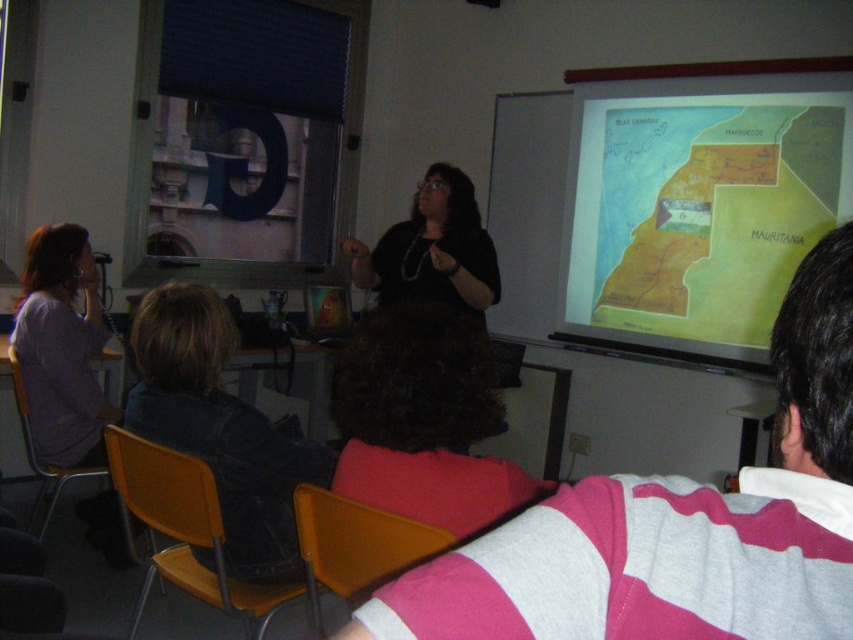
Question: Estimate the real-world distances between objects in this image. Which object is closer to the striped cotton shirt at center?

Choices:
 (A) dark blue jacket at lower left
 (B) yellow paper map at upper right

Answer: (A)

Question: Is striped cotton shirt at center below yellow paper map at upper right?

Choices:
 (A) yes
 (B) no

Answer: (A)

Question: Which of these objects is positioned farthest from the dark blue jacket at lower left?

Choices:
 (A) striped cotton shirt at center
 (B) yellow paper map at upper right

Answer: (B)

Question: Which of the following is the farthest from the observer?

Choices:
 (A) (717, 285)
 (B) (590, 532)

Answer: (A)

Question: From the image, what is the correct spatial relationship of yellow paper map at upper right in relation to dark blue jacket at lower left?

Choices:
 (A) above
 (B) below

Answer: (A)

Question: Is yellow paper map at upper right above dark blue jacket at lower left?

Choices:
 (A) no
 (B) yes

Answer: (B)